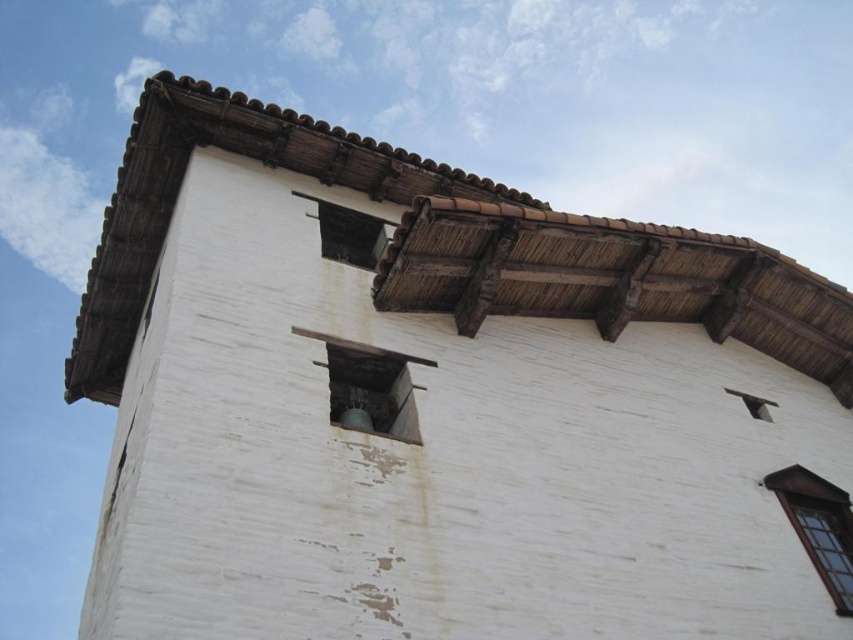
Question: Does wooden window at upper center appear under transparent glass window at upper left?

Choices:
 (A) no
 (B) yes

Answer: (A)

Question: Is dark wood window at upper right further to the viewer compared to wooden window at upper center?

Choices:
 (A) no
 (B) yes

Answer: (A)

Question: Which point is closer to the camera taking this photo?

Choices:
 (A) (149, 301)
 (B) (346, 227)
 (C) (827, 566)

Answer: (C)

Question: Which of these objects is positioned farthest from the transparent glass window at upper left?

Choices:
 (A) dark wood window at upper right
 (B) wooden window at upper center

Answer: (A)

Question: Can you confirm if wooden window at upper center is positioned below transparent glass window at upper left?

Choices:
 (A) no
 (B) yes

Answer: (A)

Question: Which of these objects is positioned farthest from the dark wood window at upper right?

Choices:
 (A) wooden window at upper center
 (B) transparent glass window at upper left

Answer: (B)